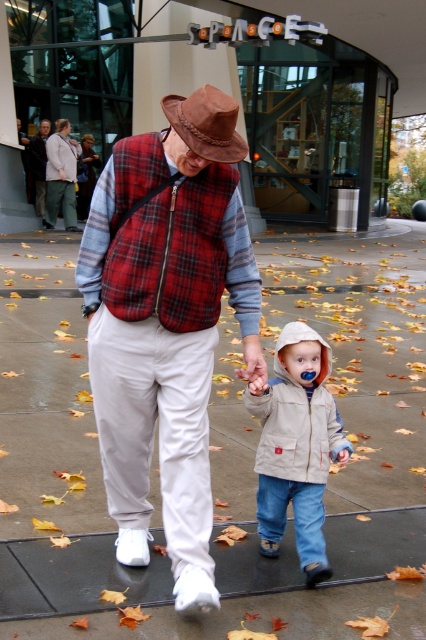
Which is below, concrete pavement at center or brown leather fedora at center?

concrete pavement at center

Who is shorter, concrete pavement at center or brown leather fedora at center?

Standing shorter between the two is brown leather fedora at center.

Which is in front, point (173, 616) or point (206, 147)?

Point (206, 147)

This screenshot has width=426, height=640. What are the coordinates of `concrete pavement at center` in the screenshot? It's located at (362, 348).

Which is more to the right, plaid fabric vest at center or khaki fabric jacket at center?

Positioned to the right is khaki fabric jacket at center.

What do you see at coordinates (166, 323) in the screenshot? Image resolution: width=426 pixels, height=640 pixels. I see `plaid fabric vest at center` at bounding box center [166, 323].

Locate an element on the screen. Image resolution: width=426 pixels, height=640 pixels. plaid fabric vest at center is located at coordinates (166, 323).

Does point (212, 140) come in front of point (39, 209)?

Yes.

Does point (238, 144) come closer to viewer compared to point (45, 136)?

Yes, point (238, 144) is closer to viewer.

Where is `brown leather fedora at center`? Image resolution: width=426 pixels, height=640 pixels. brown leather fedora at center is located at coordinates (207, 124).